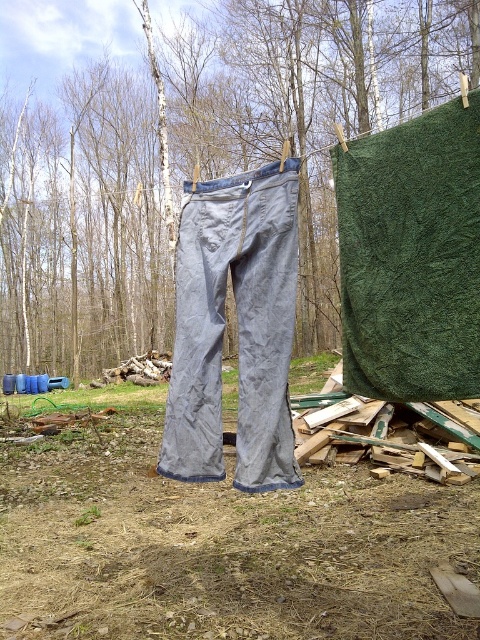
You are standing in the backyard and see the green fabric at center and the green textured fabric at upper right. Which one is higher up in the scene?

The green fabric at center is higher up in the scene than the green textured fabric at upper right.

You are standing in the backyard and see the green fabric at center and the gray cotton pants at center. Which one is positioned to the left?

The green fabric at center is positioned to the left of the gray cotton pants at center.

You are standing in the backyard and want to take a photo of the gray pants hanging on the clothesline. The camera you are using has a maximum focus range of 90 feet. Will the point at coordinates point [231,109] be in focus when you take the photo?

The point at coordinates point [231,109] is 88.97 feet from the camera, which is within the maximum focus range of 90 feet. Therefore, the point will be in focus when you take the photo.